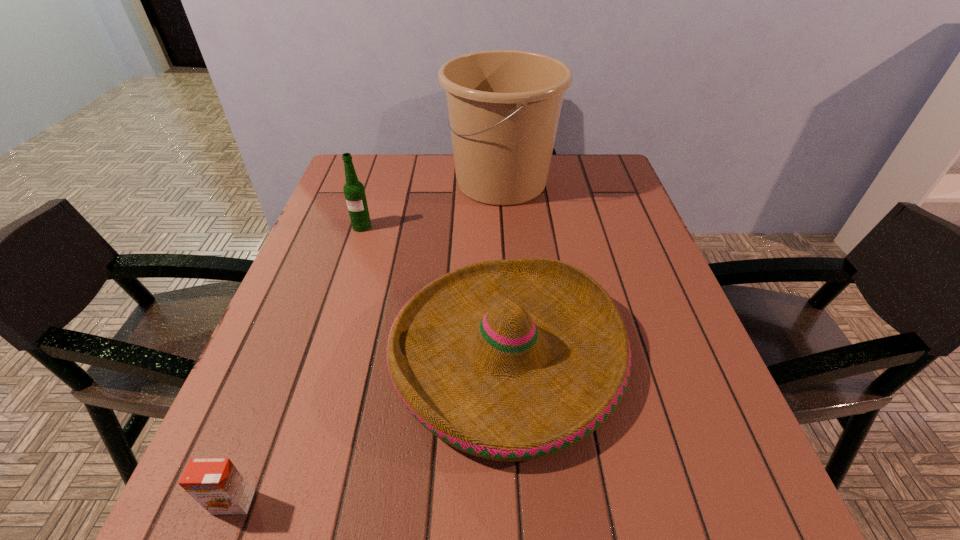
This screenshot has width=960, height=540. I want to click on vacant space at the left edge, so [x=298, y=349].

In the image, there is a desktop. Identify the location of vacant area at the right edge. The width and height of the screenshot is (960, 540). (650, 272).

This screenshot has height=540, width=960. What are the coordinates of `vacant space at the far left corner of the desktop` in the screenshot? It's located at (357, 159).

In order to click on vacant position at the near right corner of the desktop in this screenshot , I will do `click(753, 508)`.

What are the coordinates of `free spot between the sombrero and the leftmost object` in the screenshot? It's located at (371, 428).

Where is `free space between the second tallest object and the tallest object`? The height and width of the screenshot is (540, 960). free space between the second tallest object and the tallest object is located at coordinates (432, 205).

The image size is (960, 540). Find the location of `empty space between the leftmost object and the third tallest object`. empty space between the leftmost object and the third tallest object is located at coordinates (371, 428).

At what (x,y) coordinates should I click in order to perform the action: click on unoccupied position between the bucket and the nearest object. Please return your answer as a coordinate pair (x, y). The image size is (960, 540). Looking at the image, I should click on (368, 342).

Where is `vacant point located between the beer bottle and the bucket`? vacant point located between the beer bottle and the bucket is located at coordinates (432, 205).

The image size is (960, 540). I want to click on empty location between the orange juice and the second nearest object, so click(371, 428).